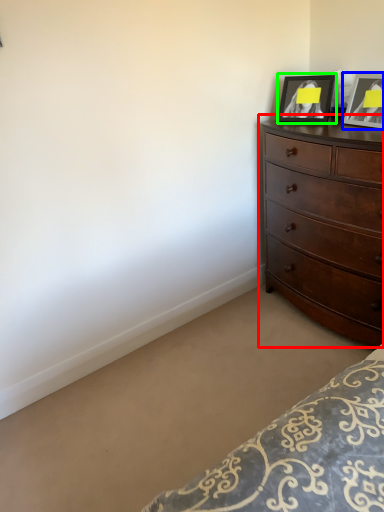
Question: Which object is the farthest from chest of drawers (highlighted by a red box)? Choose among these: picture frame (highlighted by a blue box) or picture frame (highlighted by a green box).

Choices:
 (A) picture frame
 (B) picture frame

Answer: (B)